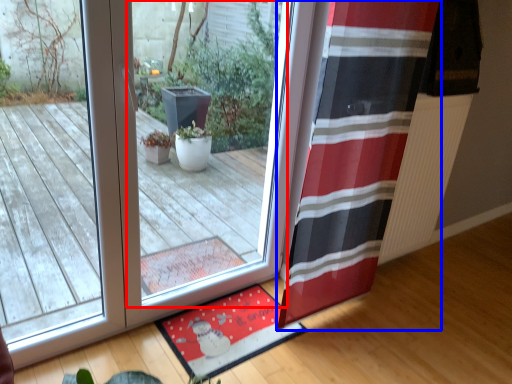
Question: Which object is closer to the camera taking this photo, window (highlighted by a red box) or curtain (highlighted by a blue box)?

Choices:
 (A) window
 (B) curtain

Answer: (A)